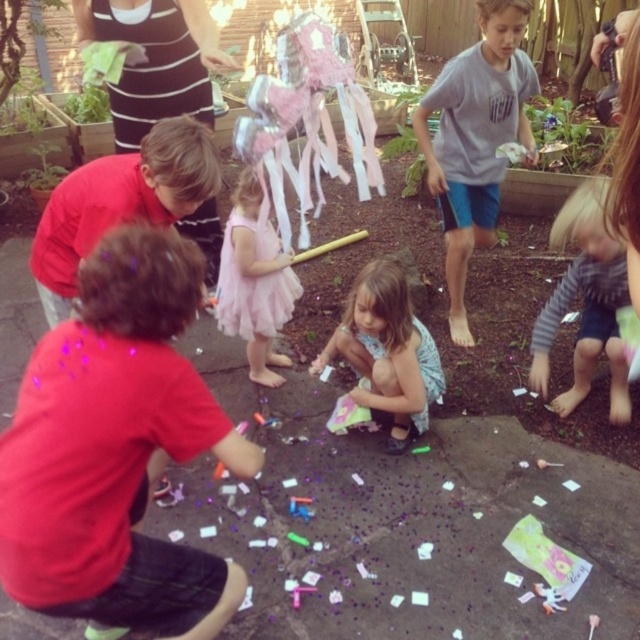
Between blurred blonde hair at lower right and pink tulle dress at center, which one appears on the right side from the viewer's perspective?

blurred blonde hair at lower right

Between blurred blonde hair at lower right and pink tulle dress at center, which one is positioned lower?

blurred blonde hair at lower right is lower down.

Describe the element at coordinates (586, 304) in the screenshot. I see `blurred blonde hair at lower right` at that location.

You are a GUI agent. You are given a task and a screenshot of the screen. Output one action in this format:
    pyautogui.click(x=<x>, y=<y>)
    Task: Click on the blurred blonde hair at lower right
    The image size is (640, 640).
    Given the screenshot: What is the action you would take?
    pyautogui.click(x=586, y=304)

Between point (164, 164) and point (566, 400), which one is positioned behind?

Point (566, 400)

Who is positioned more to the left, red matte shirt at lower left or blurred blonde hair at lower right?

red matte shirt at lower left

This screenshot has width=640, height=640. What do you see at coordinates (120, 202) in the screenshot?
I see `red matte shirt at lower left` at bounding box center [120, 202].

Where is `red matte shirt at lower left`? Image resolution: width=640 pixels, height=640 pixels. red matte shirt at lower left is located at coordinates (120, 202).

Who is shorter, matte red shirt at lower left or pastel pink tutu at center?

pastel pink tutu at center is shorter.

Who is lower down, matte red shirt at lower left or pastel pink tutu at center?

matte red shirt at lower left is below.

Where is `matte red shirt at lower left`? This screenshot has width=640, height=640. matte red shirt at lower left is located at coordinates (115, 449).

Where is `matte red shirt at lower left`? This screenshot has width=640, height=640. matte red shirt at lower left is located at coordinates (115, 449).